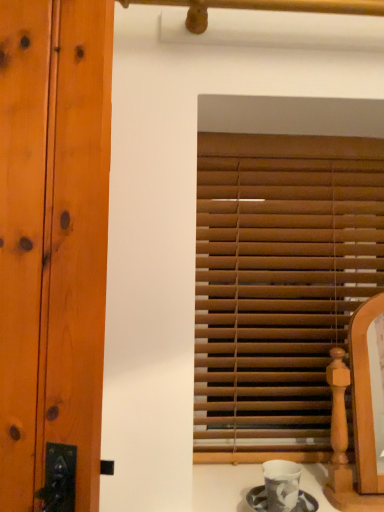
The width and height of the screenshot is (384, 512). Describe the element at coordinates (281, 490) in the screenshot. I see `porcelain cup at lower center` at that location.

Find the location of a particular element. This screenshot has width=384, height=512. porcelain cup at lower center is located at coordinates (281, 490).

Where is `wooden blinds at center`? The height and width of the screenshot is (512, 384). wooden blinds at center is located at coordinates (279, 285).

The image size is (384, 512). Describe the element at coordinates (279, 285) in the screenshot. I see `wooden blinds at center` at that location.

Where is `porcelain cup at lower center`? The image size is (384, 512). porcelain cup at lower center is located at coordinates (281, 490).

Considering the positions of objects wooden blinds at center and porcelain cup at lower center in the image provided, who is more to the right, wooden blinds at center or porcelain cup at lower center?

wooden blinds at center is more to the right.

Which object is more forward, wooden blinds at center or porcelain cup at lower center?

porcelain cup at lower center.

Considering the points (288, 451) and (267, 489), which point is behind, point (288, 451) or point (267, 489)?

The point (288, 451) is farther from the camera.

From the image's perspective, does wooden blinds at center appear higher than porcelain cup at lower center?

Yes, from the image's perspective, wooden blinds at center is over porcelain cup at lower center.

From a real-world perspective, between wooden blinds at center and porcelain cup at lower center, who is vertically lower?

In real-world perspective, porcelain cup at lower center is lower.

Considering the relative sizes of wooden blinds at center and porcelain cup at lower center in the image provided, is wooden blinds at center wider than porcelain cup at lower center?

No, wooden blinds at center is not wider than porcelain cup at lower center.

Is wooden blinds at center taller than porcelain cup at lower center?

Correct, wooden blinds at center is much taller as porcelain cup at lower center.

Does wooden blinds at center have a larger size compared to porcelain cup at lower center?

Indeed, wooden blinds at center has a larger size compared to porcelain cup at lower center.

Can we say wooden blinds at center lies outside porcelain cup at lower center?

Yes, wooden blinds at center is outside of porcelain cup at lower center.

Is wooden blinds at center far from porcelain cup at lower center?

That's not correct — wooden blinds at center is a little close to porcelain cup at lower center.

Based on the photo, is wooden blinds at center turned away from porcelain cup at lower center?

wooden blinds at center does not have its back to porcelain cup at lower center.

Based on the photo, can you tell me how much wooden blinds at center and porcelain cup at lower center differ in facing direction?

They differ by 0.533 degrees in their facing directions.

Identify the location of window blind behind the porcelain cup at lower center. (279, 285).

Which is more to the right, porcelain cup at lower center or wooden blinds at center?

Positioned to the right is wooden blinds at center.

Is porcelain cup at lower center further to the viewer compared to wooden blinds at center?

That is False.

Considering the points (253, 501) and (216, 310), which point is behind, point (253, 501) or point (216, 310)?

The point (216, 310) is farther.

Looking at this image, from the image's perspective, which is above, porcelain cup at lower center or wooden blinds at center?

wooden blinds at center is shown above in the image.

Looking at this image, from a real-world perspective, is porcelain cup at lower center below wooden blinds at center?

Yes, from a real-world perspective, porcelain cup at lower center is under wooden blinds at center.

Considering the sizes of porcelain cup at lower center and wooden blinds at center in the image, is porcelain cup at lower center wider or thinner than wooden blinds at center?

In the image, porcelain cup at lower center appears to be wider than wooden blinds at center.

Who is shorter, porcelain cup at lower center or wooden blinds at center?

porcelain cup at lower center.

In terms of size, does porcelain cup at lower center appear bigger or smaller than wooden blinds at center?

porcelain cup at lower center is smaller than wooden blinds at center.

Is porcelain cup at lower center inside or outside of wooden blinds at center?

porcelain cup at lower center is located beyond the bounds of wooden blinds at center.

Can you see porcelain cup at lower center touching wooden blinds at center?

No, porcelain cup at lower center is not with wooden blinds at center.

Is porcelain cup at lower center aimed at wooden blinds at center?

No, porcelain cup at lower center is not facing towards wooden blinds at center.

How far apart are porcelain cup at lower center and wooden blinds at center?

19.81 inches.

Find the location of `tea set in front of the wooden blinds at center`. tea set in front of the wooden blinds at center is located at coordinates (281, 490).

Image resolution: width=384 pixels, height=512 pixels. I want to click on window blind above the porcelain cup at lower center (from a real-world perspective), so click(x=279, y=285).

This screenshot has width=384, height=512. In order to click on window blind above the porcelain cup at lower center (from the image's perspective) in this screenshot , I will do `click(279, 285)`.